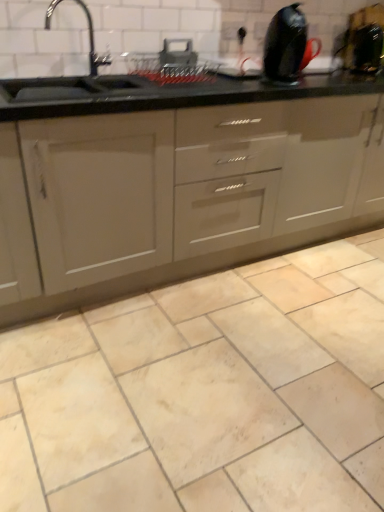
Question: Does beige marble tile at center have a lesser width compared to matte gray cabinet at center?

Choices:
 (A) yes
 (B) no

Answer: (B)

Question: Would you say beige marble tile at center contains matte gray cabinet at center?

Choices:
 (A) yes
 (B) no

Answer: (B)

Question: From a real-world perspective, is beige marble tile at center on matte gray cabinet at center?

Choices:
 (A) no
 (B) yes

Answer: (A)

Question: From the image's perspective, is beige marble tile at center on matte gray cabinet at center?

Choices:
 (A) no
 (B) yes

Answer: (A)

Question: Is beige marble tile at center outside of matte gray cabinet at center?

Choices:
 (A) no
 (B) yes

Answer: (B)

Question: Is beige marble tile at center to the left or to the right of black glossy kettle at upper right, which is the 1th appliance from right to left, in the image?

Choices:
 (A) right
 (B) left

Answer: (B)

Question: Considering their positions, is beige marble tile at center located in front of or behind black glossy kettle at upper right, the 4th appliance viewed from the left?

Choices:
 (A) behind
 (B) front

Answer: (B)

Question: Looking at their shapes, would you say beige marble tile at center is wider or thinner than black glossy kettle at upper right, which is the 1th appliance from right to left?

Choices:
 (A) wide
 (B) thin

Answer: (A)

Question: Is beige marble tile at center taller or shorter than black glossy kettle at upper right, the 4th appliance viewed from the left?

Choices:
 (A) short
 (B) tall

Answer: (A)

Question: Is metallic silver rack at upper center, the 1th appliance in the left-to-right sequence, bigger or smaller than beige marble tile at center?

Choices:
 (A) big
 (B) small

Answer: (B)

Question: Considering the positions of point (135, 69) and point (226, 406), is point (135, 69) closer or farther from the camera than point (226, 406)?

Choices:
 (A) closer
 (B) farther

Answer: (B)

Question: From the image's perspective, is metallic silver rack at upper center, the 1th appliance in the left-to-right sequence, above or below beige marble tile at center?

Choices:
 (A) below
 (B) above

Answer: (B)

Question: From a real-world perspective, is metallic silver rack at upper center, the 1th appliance in the left-to-right sequence, physically located above or below beige marble tile at center?

Choices:
 (A) above
 (B) below

Answer: (A)

Question: Considering their positions, is metallic silver rack at upper center, acting as the 4th appliance starting from the right, located in front of or behind metallic silver toaster at upper center, acting as the 2th appliance starting from the left?

Choices:
 (A) behind
 (B) front

Answer: (B)

Question: In terms of size, does metallic silver rack at upper center, acting as the 4th appliance starting from the right, appear bigger or smaller than metallic silver toaster at upper center, the 3th appliance viewed from the right?

Choices:
 (A) small
 (B) big

Answer: (B)